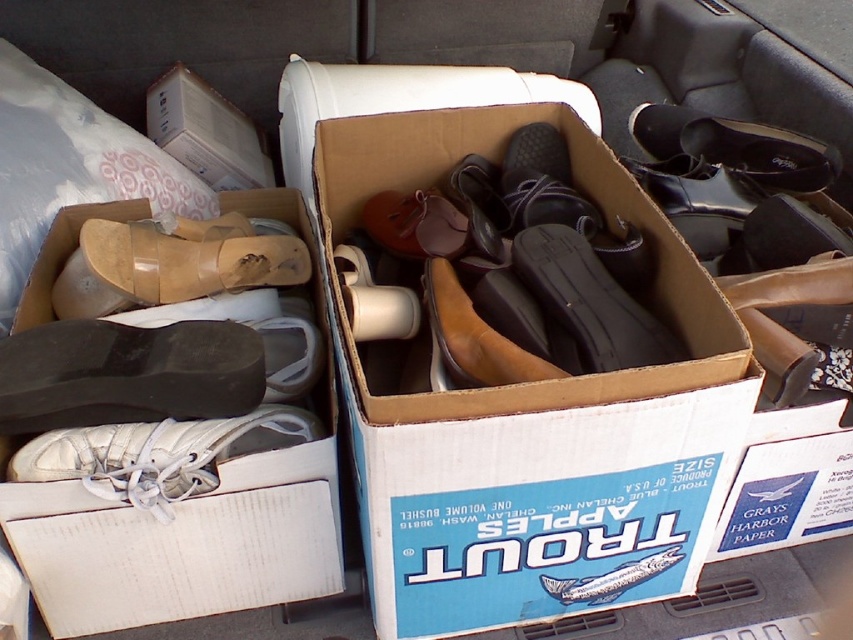
You are packing your car trunk for a road trip and need to know if the transparent plastic sandal at center can fit inside the brown cardboard box at center. Based on the scene description, can it fit?

The brown cardboard box at center is larger in size than transparent plastic sandal at center, so yes, the transparent plastic sandal at center can fit inside the brown cardboard box at center.

You are standing in front of the vehicle trunk and want to retrieve an item. If you first reach toward the point at coordinate point (569, 474) and then move to point point (132, 337), will you be moving forward or backward relative to the trunk?

Since point 0.742, 0668 is in front of point (132, 337), moving from point (569, 474) to point (132, 337) means you are moving backward relative to the trunk.